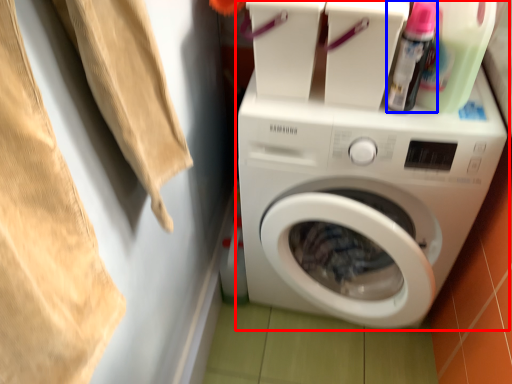
Question: Among these objects, which one is nearest to the camera, washing machine (highlighted by a red box) or cleaning product (highlighted by a blue box)?

Choices:
 (A) washing machine
 (B) cleaning product

Answer: (B)